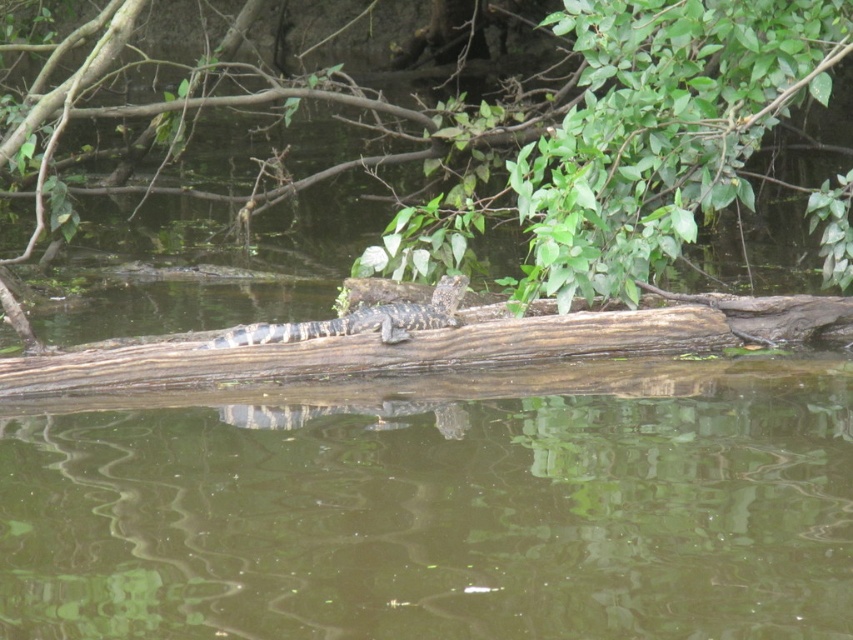
You are an observer looking at the scene. Which object takes up more space in the image, the green leafy tree at upper center or the brown textured log at center?

The brown textured log at center takes up more space in the image than the green leafy tree at upper center, as the tree occupies less space according to the description.

You are a photographer standing at the edge of the water. You want to take a photo of the brown wood log at center and the green leafy tree at upper center. Which object will appear larger in your photo?

The brown wood log at center will appear larger in the photo because it is closer to the viewer than the green leafy tree at upper center.

You are a bird flying over the natural scene. You see the brown wood log at center and the green leafy tree at upper center. Which object is closer to the water surface?

The brown wood log at center is closer to the water surface because it is located below the green leafy tree at upper center.